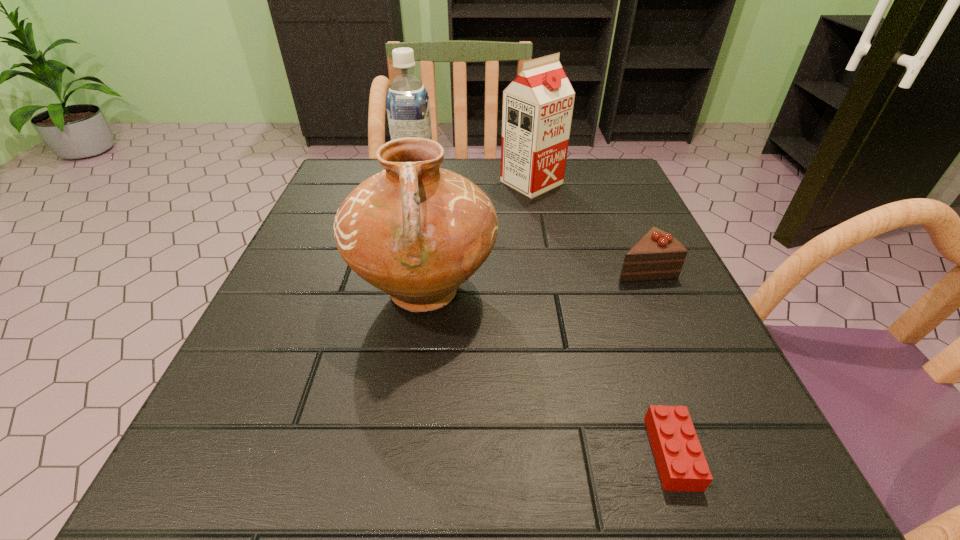
The height and width of the screenshot is (540, 960). In order to click on the left soya milk in this screenshot , I will do `click(408, 108)`.

Locate an element on the screen. Image resolution: width=960 pixels, height=540 pixels. the third object from left to right is located at coordinates (538, 104).

The height and width of the screenshot is (540, 960). In order to click on pottery in this screenshot , I will do `click(417, 232)`.

The width and height of the screenshot is (960, 540). What are the coordinates of `the second shortest object` in the screenshot? It's located at (657, 255).

At what (x,y) coordinates should I click in order to perform the action: click on the shortest object. Please return your answer as a coordinate pair (x, y). This screenshot has height=540, width=960. Looking at the image, I should click on (682, 466).

Where is `Lego`? This screenshot has width=960, height=540. Lego is located at coordinates (682, 466).

Find the location of a particular element. This screenshot has height=540, width=960. free point located on the label of the left soya milk is located at coordinates (555, 183).

At what (x,y) coordinates should I click in order to perform the action: click on free space located 0.170m on the front of the right soya milk. Please return your answer as a coordinate pair (x, y). This screenshot has width=960, height=540. Looking at the image, I should click on (542, 245).

This screenshot has height=540, width=960. What are the coordinates of `vacant space positioned on the side of the pottery with the handle` in the screenshot? It's located at (396, 499).

Where is `blank space located 0.320m on the left of the fourth tallest object`? Image resolution: width=960 pixels, height=540 pixels. blank space located 0.320m on the left of the fourth tallest object is located at coordinates (436, 268).